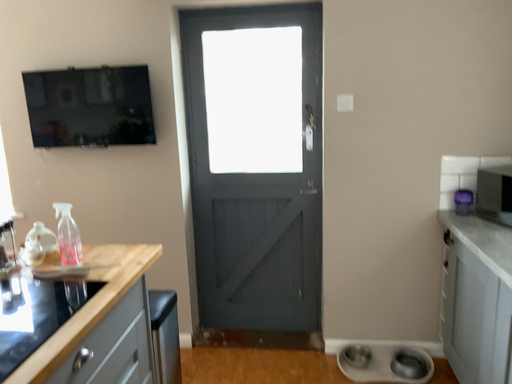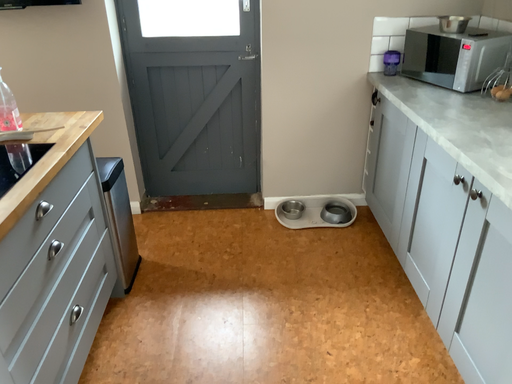
Question: Which way did the camera rotate in the video?

Choices:
 (A) rotated downward
 (B) rotated upward

Answer: (A)